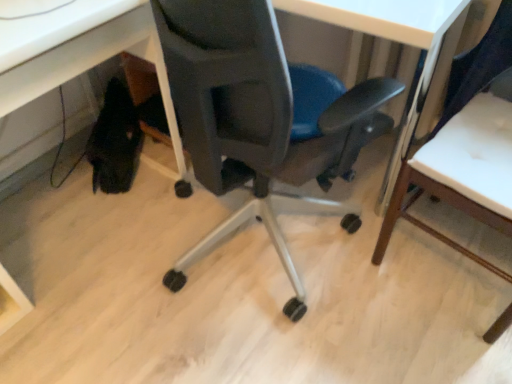
Question: Could you tell me if matte black chair at center, which is the first chair from left to right, is turned towards matte black chair at lower left?

Choices:
 (A) yes
 (B) no

Answer: (A)

Question: From a real-world perspective, is matte black chair at center, which is the first chair from left to right, physically below matte black chair at lower left?

Choices:
 (A) yes
 (B) no

Answer: (B)

Question: From the image's perspective, would you say matte black chair at center, which is counted as the 2th chair, starting from the right, is shown under matte black chair at lower left?

Choices:
 (A) yes
 (B) no

Answer: (B)

Question: Is matte black chair at center, which is counted as the 2th chair, starting from the right, surrounding matte black chair at lower left?

Choices:
 (A) no
 (B) yes

Answer: (A)

Question: Is matte black chair at center, which is counted as the 2th chair, starting from the right, smaller than matte black chair at lower left?

Choices:
 (A) no
 (B) yes

Answer: (A)

Question: Considering the relative sizes of matte black chair at center, which is the first chair from left to right, and matte black chair at lower left in the image provided, is matte black chair at center, which is the first chair from left to right, shorter than matte black chair at lower left?

Choices:
 (A) yes
 (B) no

Answer: (B)

Question: Does matte black chair at center, which is the first chair from left to right, have a greater height compared to wooden chair at right, the first chair viewed from the right?

Choices:
 (A) yes
 (B) no

Answer: (A)

Question: Is matte black chair at center, which is counted as the 2th chair, starting from the right, placed right next to wooden chair at right, the 2th chair in the left-to-right sequence?

Choices:
 (A) no
 (B) yes

Answer: (A)

Question: From a real-world perspective, is matte black chair at center, which is the first chair from left to right, located higher than wooden chair at right, the first chair viewed from the right?

Choices:
 (A) yes
 (B) no

Answer: (A)

Question: Can you confirm if matte black chair at center, which is the first chair from left to right, is bigger than wooden chair at right, the 2th chair in the left-to-right sequence?

Choices:
 (A) no
 (B) yes

Answer: (B)

Question: Is matte black chair at center, which is counted as the 2th chair, starting from the right, at the right side of wooden chair at right, the 2th chair in the left-to-right sequence?

Choices:
 (A) no
 (B) yes

Answer: (A)

Question: Is matte black chair at center, which is the first chair from left to right, at the left side of wooden chair at right, the 2th chair in the left-to-right sequence?

Choices:
 (A) no
 (B) yes

Answer: (B)

Question: Does matte black chair at lower left come in front of matte black chair at center, which is counted as the 2th chair, starting from the right?

Choices:
 (A) yes
 (B) no

Answer: (A)